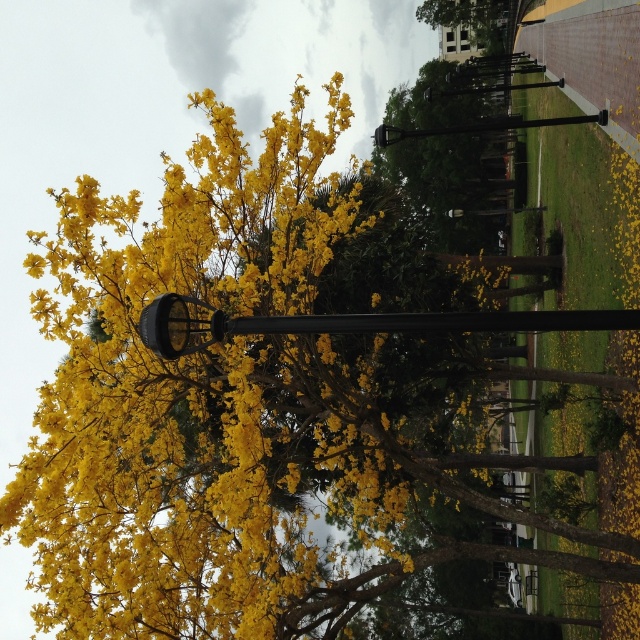
Who is more forward, (321, 330) or (394, 140)?

Point (321, 330) is in front.

Can you confirm if black metal lamp post at center is thinner than black metal pole at center?

Yes.

Which is behind, point (173, 349) or point (577, 120)?

The point (577, 120) is behind.

Where is `black metal lamp post at center`? The width and height of the screenshot is (640, 640). black metal lamp post at center is located at coordinates (348, 323).